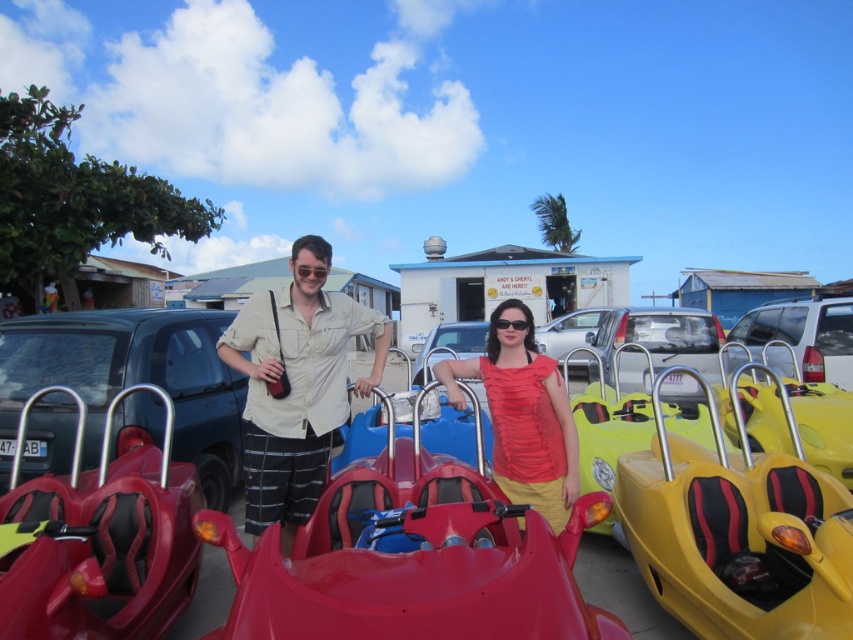
You are a photographer trying to capture a photo of the metallic red toy car at left and the white matte suv at center. Which vehicle should you focus on first if you want to include both in your shot without moving the camera?

A: The metallic red toy car at left is positioned on the left side of the white matte suv at center, so you should focus on the metallic red toy car at left first to ensure both are in frame.

You are a photographer setting up for a group photo. You want to ensure that both the shiny plastic toy car at center and the matte red shirt at center are clearly visible in the shot. Based on their positions, which object should you focus on first to make sure both are in focus?

The shiny plastic toy car at center is in front of the matte red shirt at center. To ensure both are in focus, you should focus on the shiny plastic toy car at center first since it is closer to the camera.

You are a photographer trying to capture a photo of the matte black car at center and the beige cotton shirt at center. Which object will appear taller in the final photo?

The beige cotton shirt at center will appear taller in the photo because it is taller than the matte black car at center.